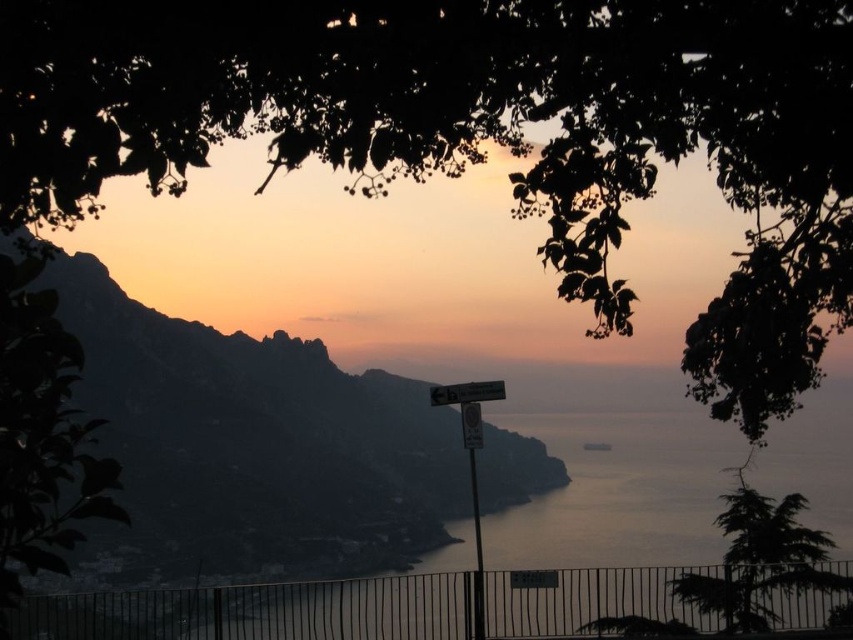
Does silvery metallic mountain at center appear under silvery water at center?

Actually, silvery metallic mountain at center is above silvery water at center.

Is silvery metallic mountain at center to the left of silvery water at center from the viewer's perspective?

Indeed, silvery metallic mountain at center is positioned on the left side of silvery water at center.

Find the location of a particular element. This screenshot has width=853, height=640. silvery metallic mountain at center is located at coordinates (250, 449).

Does silvery water at center appear over metallic sign at center?

Incorrect, silvery water at center is not positioned above metallic sign at center.

The image size is (853, 640). Describe the element at coordinates (618, 492) in the screenshot. I see `silvery water at center` at that location.

What do you see at coordinates (618, 492) in the screenshot?
I see `silvery water at center` at bounding box center [618, 492].

Where is `silvery water at center`? silvery water at center is located at coordinates (618, 492).

Who is higher up, green textured tree at lower right or metallic sign at center?

metallic sign at center

Which is in front, point (758, 616) or point (461, 412)?

Point (461, 412)

Where is `green textured tree at lower right`? green textured tree at lower right is located at coordinates (759, 561).

Identify the location of green textured tree at lower right. The height and width of the screenshot is (640, 853). (759, 561).